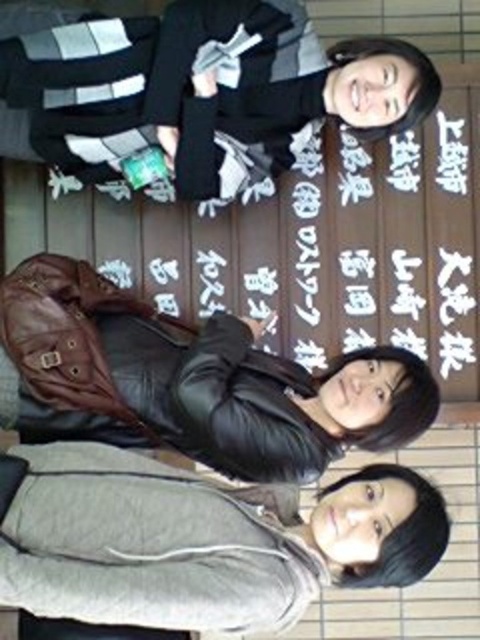
You are trying to decide which jacket to take for a casual winter walk. Both the gray fleece jacket at lower right and the black leather jacket at center are available. Based on their sizes, which one would be more appropriate if you prefer a compact and lightweight option?

The gray fleece jacket at lower right is smaller than the black leather jacket at center, so it would be more appropriate for a compact and lightweight option.

You are standing in front of the bench and want to see both the black leather jacket at upper center and the black leather jacket at center. Which one is blocking the view of the other?

The black leather jacket at center is behind the black leather jacket at upper center, so the upper center jacket is blocking the view of the center jacket.

Based on the photo, you are a photographer standing 5 feet away from the bench. You want to take a photo of the gray fleece jacket at lower right and the black leather jacket at center. Can you fit both in the frame if your camera has a 50mm lens? Explain your reasoning.

The distance between the gray fleece jacket at lower right and the black leather jacket at center is 30.88 inches. A 50mm lens has a field of view wide enough to capture objects within a 5 feet distance and spaced 30.88 inches apart. Therefore, both jackets can be included in the frame.